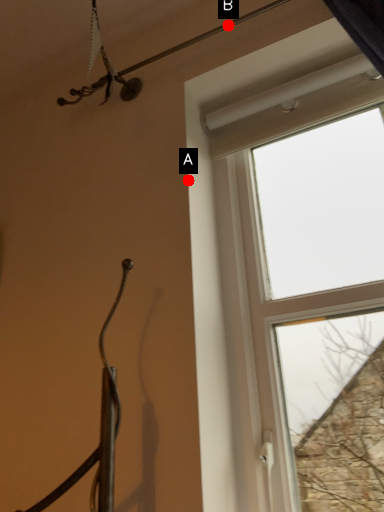
Question: Two points are circled on the image, labeled by A and B beside each circle. Which point is closer to the camera taking this photo?

Choices:
 (A) A is closer
 (B) B is closer

Answer: (A)